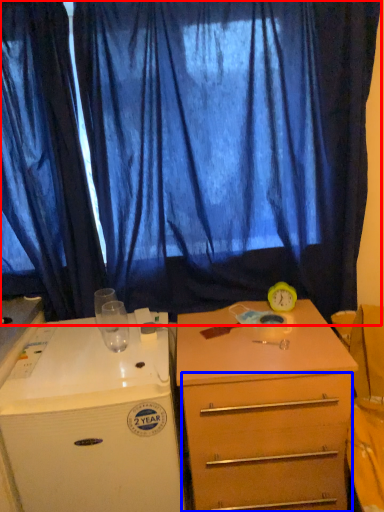
Question: Which of the following is the farthest to the observer, curtain (highlighted by a red box) or drawer (highlighted by a blue box)?

Choices:
 (A) curtain
 (B) drawer

Answer: (A)